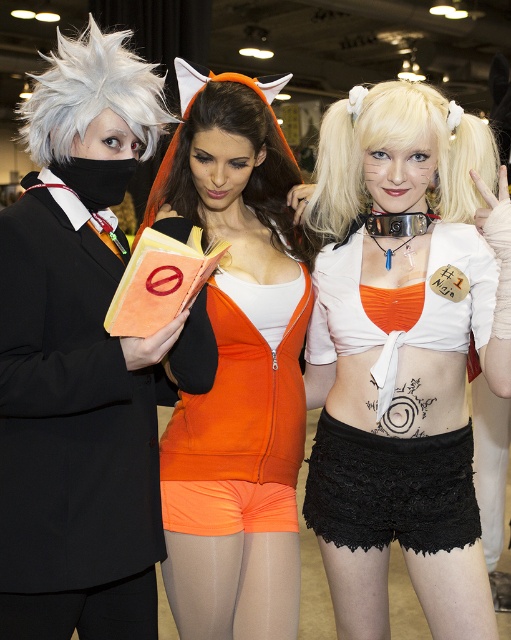
You are a photographer at a convention and need to frame a shot that includes both the matte black suit at left and the neon orange tights at center. Considering their positions and sizes, which object should you adjust your camera angle to prioritize to ensure both fit in the frame?

The matte black suit at left might be wider than neon orange tights at center, so you should prioritize adjusting your camera angle to accommodate the width of the matte black suit at left to ensure both fit in the frame.